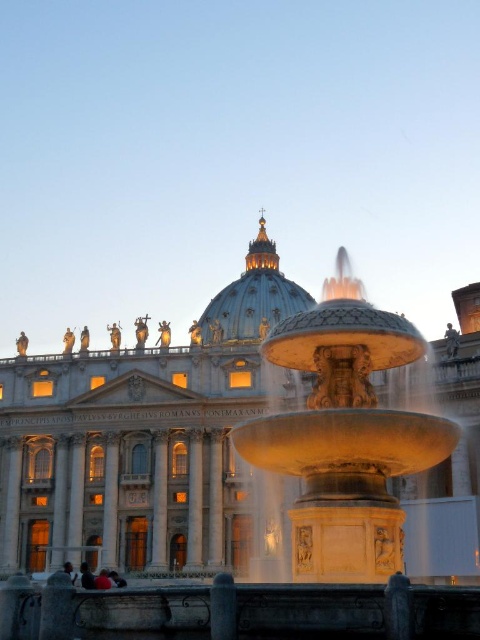
You are standing at the point with coordinates (x=345, y=435) in the image. What object are you standing on?

The point (x=345, y=435) corresponds to the gold polished stone fountain at center.

You are standing at the edge of the fountain in the foreground. You want to take a photo of the golden stone dome at center and the smooth skin person at lower left together in the same frame. Will both fit in your camera viewfinder if the viewfinder can only accommodate objects within a 100 cm width?

The golden stone dome at center might be wider than smooth skin person at lower left, so it is uncertain if both will fit within the 100 cm width of the viewfinder. You may need to adjust your position or zoom level to ensure both are visible.

From the picture: You are standing in front of the grand building with the dome and want to take a photo. You notice two points marked on your map at coordinates point (415, 352) and point (300, 305). Which point is closer to you?

Point (415, 352) is closer to the viewer than point (300, 305).